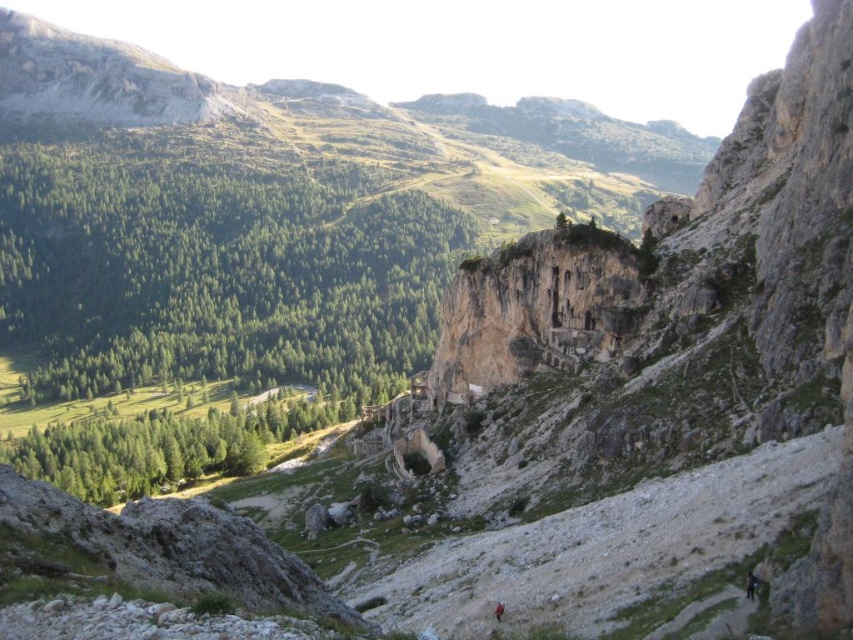
Question: Can you confirm if brown rough rock face at center is wider than dark blue fabric person at lower right?

Choices:
 (A) no
 (B) yes

Answer: (B)

Question: Which point is closer to the camera taking this photo?

Choices:
 (A) click(750, 592)
 (B) click(447, 307)

Answer: (A)

Question: In this image, where is brown rough rock face at center located relative to dark blue fabric person at lower right?

Choices:
 (A) left
 (B) right

Answer: (A)

Question: Which of the following is the farthest from the observer?

Choices:
 (A) (749, 589)
 (B) (465, 385)

Answer: (B)

Question: Is brown rough rock face at center bigger than dark blue fabric person at lower right?

Choices:
 (A) yes
 (B) no

Answer: (A)